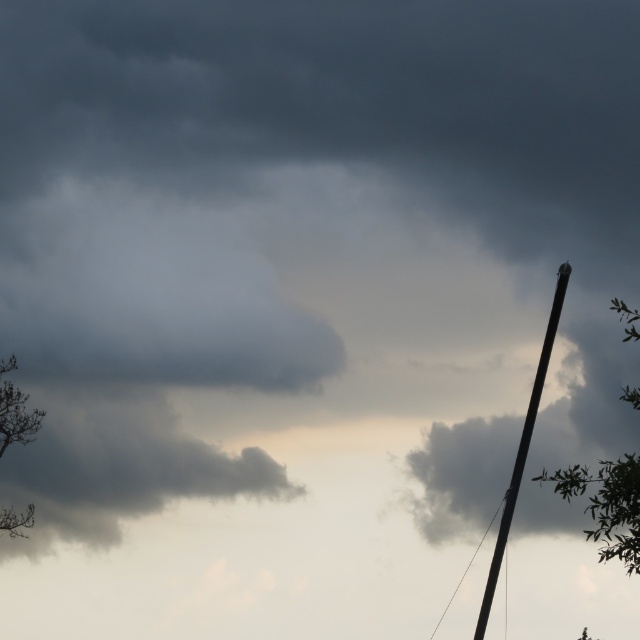
Question: Can you confirm if green leafy tree at right is positioned to the right of smooth metallic pole at right?

Choices:
 (A) no
 (B) yes

Answer: (B)

Question: Is smooth metallic pole at right behind black wire at right?

Choices:
 (A) yes
 (B) no

Answer: (B)

Question: Does smooth metallic pole at right appear over green leafy tree at lower left?

Choices:
 (A) no
 (B) yes

Answer: (A)

Question: Based on their relative distances, which object is farther from the green leafy tree at lower left?

Choices:
 (A) green leafy tree at right
 (B) black wire at right
 (C) dark gray cloud at center
 (D) smooth metallic pole at right

Answer: (A)

Question: Which point is closer to the camera taking this photo?

Choices:
 (A) (496, 563)
 (B) (637, 470)
 (C) (148, 444)

Answer: (B)

Question: Which point appears closest to the camera in this image?

Choices:
 (A) (8, 397)
 (B) (442, 614)
 (C) (148, 476)
 (D) (524, 458)

Answer: (D)